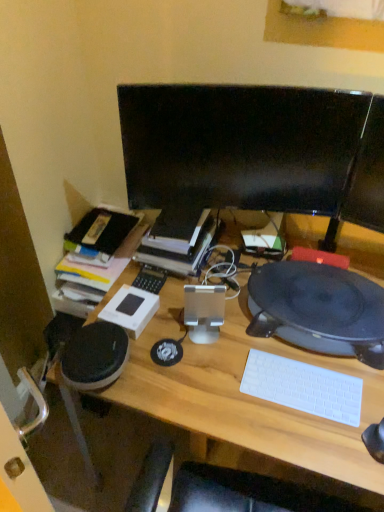
The image size is (384, 512). What are the coordinates of `vacant space to the left of black matte record player at right` in the screenshot? It's located at (204, 334).